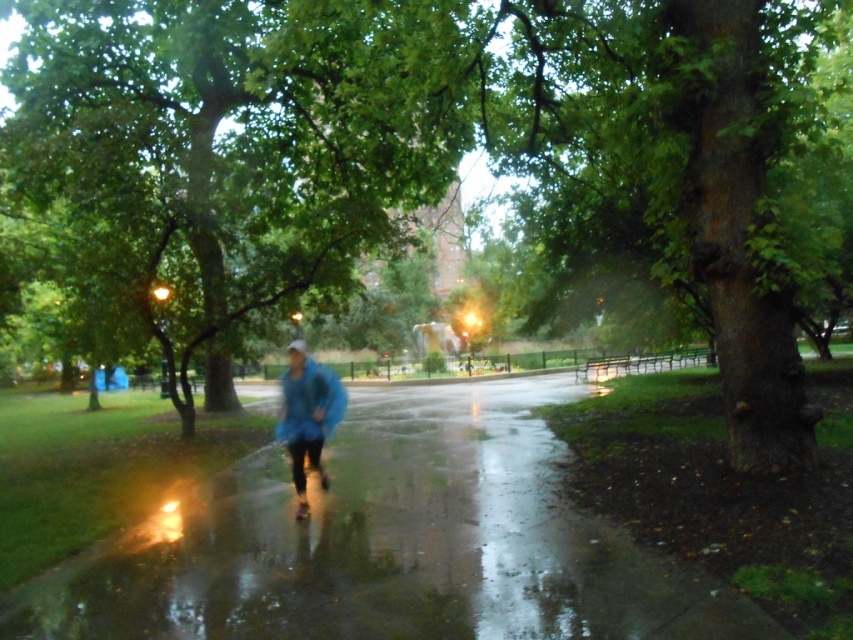
Is green leafy tree at center to the left of blue matte jacket at center from the viewer's perspective?

No, green leafy tree at center is not to the left of blue matte jacket at center.

Between green leafy tree at center and blue matte jacket at center, which one has more height?

green leafy tree at center is taller.

The height and width of the screenshot is (640, 853). Describe the element at coordinates (236, 148) in the screenshot. I see `green leafy tree at center` at that location.

Locate an element on the screen. green leafy tree at center is located at coordinates (236, 148).

Is glossy asphalt pavement at center smaller than blue matte jacket at center?

Yes, glossy asphalt pavement at center is smaller than blue matte jacket at center.

Describe the element at coordinates (389, 544) in the screenshot. The width and height of the screenshot is (853, 640). I see `glossy asphalt pavement at center` at that location.

Does point (708, 637) come in front of point (281, 413)?

Yes, point (708, 637) is closer to viewer.

This screenshot has height=640, width=853. Find the location of `glossy asphalt pavement at center`. glossy asphalt pavement at center is located at coordinates (389, 544).

Where is `green rough bark tree at right`? This screenshot has width=853, height=640. green rough bark tree at right is located at coordinates (680, 168).

Does green rough bark tree at right have a greater height compared to blue matte jacket at center?

Correct, green rough bark tree at right is much taller as blue matte jacket at center.

Between point (682, 93) and point (294, 340), which one is positioned in front?

Point (682, 93) is more forward.

The image size is (853, 640). What are the coordinates of `green rough bark tree at right` in the screenshot? It's located at (680, 168).